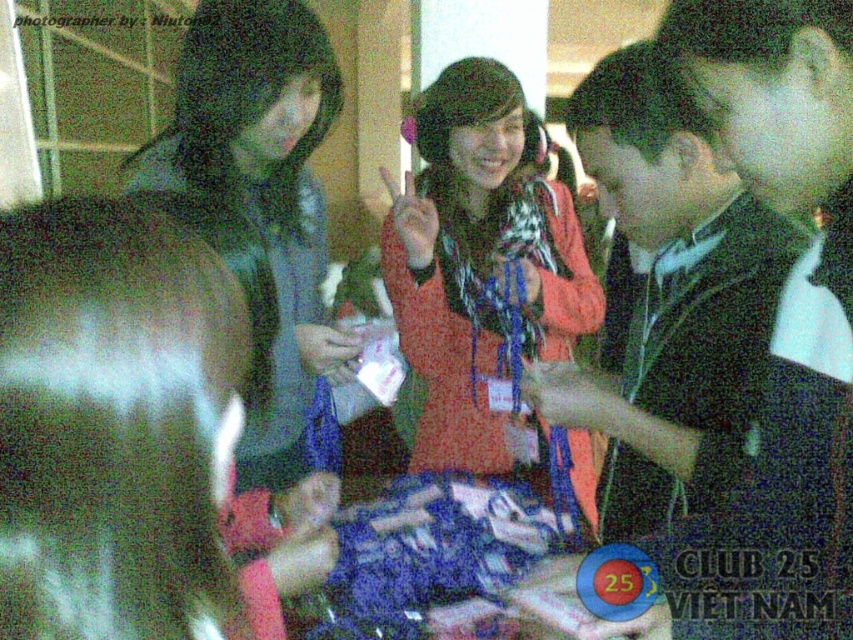
Question: Considering the relative positions of matte orange sweater at center and green leather jacket at left in the image provided, where is matte orange sweater at center located with respect to green leather jacket at left?

Choices:
 (A) below
 (B) above

Answer: (B)

Question: Which point is farther from the camera taking this photo?

Choices:
 (A) (543, 208)
 (B) (550, 404)
 (C) (312, 298)

Answer: (A)

Question: Among these points, which one is nearest to the camera?

Choices:
 (A) (293, 170)
 (B) (583, 456)
 (C) (637, 339)

Answer: (C)

Question: Which of these objects is positioned farthest from the green leather jacket at left?

Choices:
 (A) black matte jacket at center
 (B) matte orange sweater at center

Answer: (A)

Question: Can you confirm if matte orange sweater at center is positioned to the left of green leather jacket at left?

Choices:
 (A) yes
 (B) no

Answer: (B)

Question: Can you confirm if black matte jacket at center is thinner than matte orange sweater at center?

Choices:
 (A) no
 (B) yes

Answer: (B)